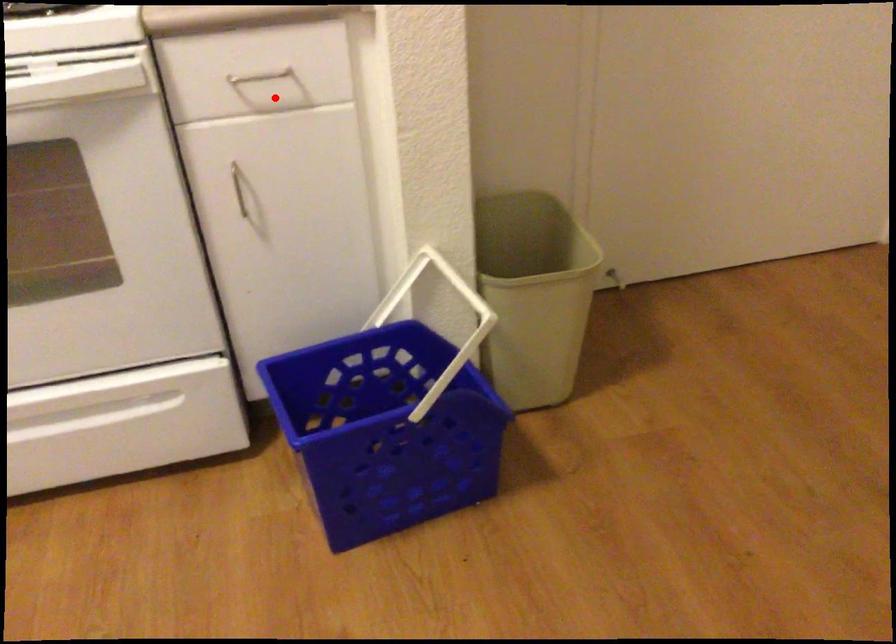
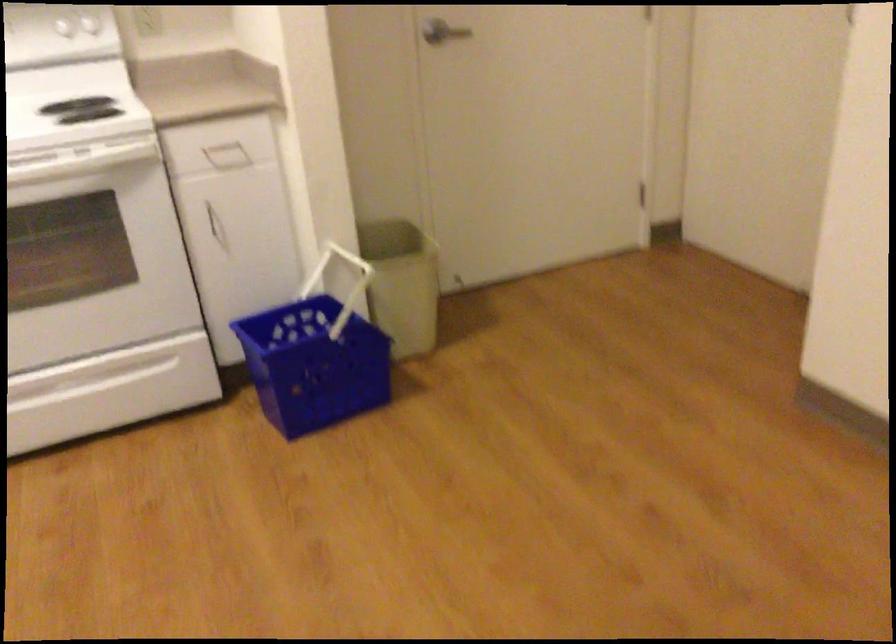
Locate, in the second image, the point that corresponds to the highlighted location in the first image.

(227, 156)